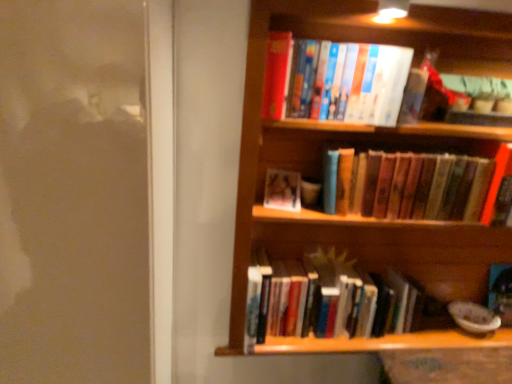
Question: From a real-world perspective, is matte plastic photo frame at center, the third book viewed from the top, beneath hardcover books at upper center, the 4th book ordered from the bottom?

Choices:
 (A) yes
 (B) no

Answer: (A)

Question: Is matte plastic photo frame at center, acting as the second book starting from the bottom, not within hardcover books at upper center, the 4th book ordered from the bottom?

Choices:
 (A) yes
 (B) no

Answer: (A)

Question: Considering the relative sizes of matte plastic photo frame at center, the third book viewed from the top, and hardcover books at upper center, the 4th book ordered from the bottom, in the image provided, is matte plastic photo frame at center, the third book viewed from the top, wider than hardcover books at upper center, the 4th book ordered from the bottom,?

Choices:
 (A) yes
 (B) no

Answer: (B)

Question: Is matte plastic photo frame at center, the third book viewed from the top, directly adjacent to hardcover books at upper center, which is counted as the 1th book, starting from the top?

Choices:
 (A) yes
 (B) no

Answer: (B)

Question: Is hardcover books at upper center, which is counted as the 1th book, starting from the top, at the back of matte plastic photo frame at center, acting as the second book starting from the bottom?

Choices:
 (A) no
 (B) yes

Answer: (A)

Question: Considering the positions of hardcover books at upper center, the 4th book ordered from the bottom, and hardcover books at center, which is counted as the third book, starting from the bottom, in the image, is hardcover books at upper center, the 4th book ordered from the bottom, bigger or smaller than hardcover books at center, which is counted as the third book, starting from the bottom,?

Choices:
 (A) small
 (B) big

Answer: (A)

Question: Is hardcover books at upper center, the 4th book ordered from the bottom, to the left or to the right of hardcover books at center, which is counted as the third book, starting from the bottom, in the image?

Choices:
 (A) left
 (B) right

Answer: (A)

Question: Considering the positions of point 330,84 and point 450,206, is point 330,84 closer or farther from the camera than point 450,206?

Choices:
 (A) closer
 (B) farther

Answer: (A)

Question: Is hardcover books at upper center, the 4th book ordered from the bottom, in front of or behind hardcover books at center, acting as the second book starting from the top, in the image?

Choices:
 (A) front
 (B) behind

Answer: (A)

Question: Is hardcover books at lower center, the 4th book positioned from the top, wider or thinner than hardcover books at center, acting as the second book starting from the top?

Choices:
 (A) wide
 (B) thin

Answer: (A)

Question: Is point (348, 281) closer or farther from the camera than point (495, 193)?

Choices:
 (A) farther
 (B) closer

Answer: (A)

Question: From the image's perspective, relative to hardcover books at center, acting as the second book starting from the top, is hardcover books at lower center, the 4th book positioned from the top, above or below?

Choices:
 (A) above
 (B) below

Answer: (B)

Question: Considering the positions of hardcover books at lower center, positioned as the 1th book in bottom-to-top order, and hardcover books at center, acting as the second book starting from the top, in the image, is hardcover books at lower center, positioned as the 1th book in bottom-to-top order, bigger or smaller than hardcover books at center, acting as the second book starting from the top,?

Choices:
 (A) big
 (B) small

Answer: (A)

Question: Based on their positions, is hardcover books at center, acting as the second book starting from the top, located to the left or right of hardcover books at upper center, which is counted as the 1th book, starting from the top?

Choices:
 (A) left
 (B) right

Answer: (B)

Question: Would you say hardcover books at center, which is counted as the third book, starting from the bottom, is inside or outside hardcover books at upper center, which is counted as the 1th book, starting from the top?

Choices:
 (A) outside
 (B) inside

Answer: (A)